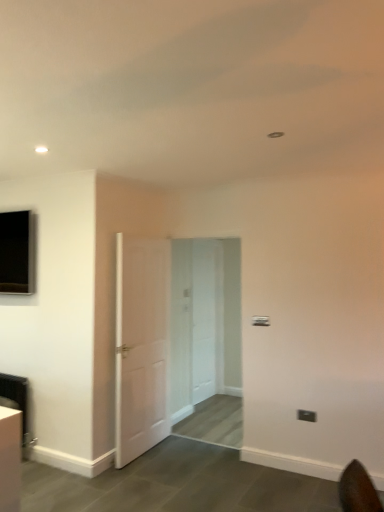
Find the location of a particular element. The width and height of the screenshot is (384, 512). black plastic electric outlet at lower right is located at coordinates (306, 415).

The image size is (384, 512). In order to click on white wooden door at center, marked as the 2th door in a left-to-right arrangement in this screenshot , I will do `click(206, 316)`.

Can you confirm if white wooden door at center, which appears as the first door when viewed from the back, is shorter than white matte door at center, arranged as the second door when viewed from the right?

Yes, white wooden door at center, which appears as the first door when viewed from the back, is shorter than white matte door at center, arranged as the second door when viewed from the right.

Is white wooden door at center, arranged as the 2th door when viewed from the front, not inside white matte door at center, arranged as the second door when viewed from the right?

white wooden door at center, arranged as the 2th door when viewed from the front, is positioned outside white matte door at center, arranged as the second door when viewed from the right.

Which object is positioned more to the right, white wooden door at center, which appears as the first door when viewed from the back, or white matte door at center, marked as the 1th door in a front-to-back arrangement?

From the viewer's perspective, white wooden door at center, which appears as the first door when viewed from the back, appears more on the right side.

Is black plastic electric outlet at lower right positioned far away from black glass window at upper left?

black plastic electric outlet at lower right is positioned a significant distance from black glass window at upper left.

Does black plastic electric outlet at lower right have a lesser width compared to black glass window at upper left?

Correct, the width of black plastic electric outlet at lower right is less than that of black glass window at upper left.

Is point (316, 419) less distant than point (30, 250)?

Yes, point (316, 419) is closer to viewer.

Is black plastic electric outlet at lower right further to camera compared to black glass window at upper left?

No, black plastic electric outlet at lower right is closer to the viewer.

Between white matte door at center, arranged as the second door when viewed from the right, and black glass window at upper left, which one has smaller width?

white matte door at center, arranged as the second door when viewed from the right.

Which object is further away from the camera, white matte door at center, arranged as the second door when viewed from the right, or black glass window at upper left?

black glass window at upper left is further away from the camera.

Considering the positions of objects white matte door at center, marked as the 1th door in a front-to-back arrangement, and black glass window at upper left in the image provided, who is more to the left, white matte door at center, marked as the 1th door in a front-to-back arrangement, or black glass window at upper left?

black glass window at upper left is more to the left.

From a real-world perspective, is white matte door at center, the 2th door viewed from the back, physically located above or below black glass window at upper left?

Clearly, from a real-world perspective, white matte door at center, the 2th door viewed from the back, is below black glass window at upper left.

Can you confirm if white wooden door at center, arranged as the 2th door when viewed from the front, is taller than black glass window at upper left?

Yes, white wooden door at center, arranged as the 2th door when viewed from the front, is taller than black glass window at upper left.

Where is `the 2nd door to the right of the black glass window at upper left, starting your count from the anchor`? the 2nd door to the right of the black glass window at upper left, starting your count from the anchor is located at coordinates (206, 316).

Does white wooden door at center, marked as the 2th door in a left-to-right arrangement, touch black glass window at upper left?

white wooden door at center, marked as the 2th door in a left-to-right arrangement, is not next to black glass window at upper left, and they're not touching.

Is white wooden door at center, marked as the 2th door in a left-to-right arrangement, facing towards black glass window at upper left?

No.

Is white wooden door at center, arranged as the 2th door when viewed from the front, to the right of black plastic electric outlet at lower right from the viewer's perspective?

Incorrect, white wooden door at center, arranged as the 2th door when viewed from the front, is not on the right side of black plastic electric outlet at lower right.

Could black plastic electric outlet at lower right be considered to be inside white wooden door at center, arranged as the 2th door when viewed from the front?

Actually, black plastic electric outlet at lower right is outside white wooden door at center, arranged as the 2th door when viewed from the front.

Based on the photo, considering the relative sizes of white wooden door at center, marked as the 2th door in a left-to-right arrangement, and black plastic electric outlet at lower right in the image provided, is white wooden door at center, marked as the 2th door in a left-to-right arrangement, shorter than black plastic electric outlet at lower right?

Incorrect, the height of white wooden door at center, marked as the 2th door in a left-to-right arrangement, does not fall short of that of black plastic electric outlet at lower right.

Can you see white wooden door at center, which appears as the first door when viewed from the back, touching black plastic electric outlet at lower right?

white wooden door at center, which appears as the first door when viewed from the back, and black plastic electric outlet at lower right are clearly separated.

From a real-world perspective, is black glass window at upper left physically located above or below white wooden door at center, arranged as the 2th door when viewed from the front?

From a real-world perspective, black glass window at upper left is physically above white wooden door at center, arranged as the 2th door when viewed from the front.

Looking at this image, from the image's perspective, which object appears higher, black glass window at upper left or white wooden door at center, arranged as the 2th door when viewed from the front?

black glass window at upper left appears higher in the image.

In the image, there is a white wooden door at center, marked as the 1th door in a right-to-left arrangement. Identify the location of window above it (from the image's perspective). (17, 252).

Could you tell me if black glass window at upper left is facing white wooden door at center, arranged as the 2th door when viewed from the front?

No.

Is black plastic electric outlet at lower right facing towards white wooden door at center, marked as the 1th door in a right-to-left arrangement?

No, black plastic electric outlet at lower right is not turned towards white wooden door at center, marked as the 1th door in a right-to-left arrangement.

What's the angular difference between black plastic electric outlet at lower right and white wooden door at center, arranged as the 2th door when viewed from the front,'s facing directions?

The angular difference between black plastic electric outlet at lower right and white wooden door at center, arranged as the 2th door when viewed from the front, is 88.8 degrees.

Which of these two, black plastic electric outlet at lower right or white wooden door at center, which appears as the first door when viewed from the back, is wider?

white wooden door at center, which appears as the first door when viewed from the back, is wider.

Which point is more forward, (304,414) or (215,368)?

Positioned in front is point (304,414).

Where is `door beneath the white wooden door at center, which appears as the first door when viewed from the back (from a real-world perspective)`? door beneath the white wooden door at center, which appears as the first door when viewed from the back (from a real-world perspective) is located at coordinates (141, 345).

Where is `electric outlet below the black glass window at upper left (from the image's perspective)`? The height and width of the screenshot is (512, 384). electric outlet below the black glass window at upper left (from the image's perspective) is located at coordinates pyautogui.click(x=306, y=415).

Which object lies nearer to the anchor point black plastic electric outlet at lower right, white matte door at center, which is the 1th door from left to right, or white wooden door at center, marked as the 1th door in a right-to-left arrangement?

white matte door at center, which is the 1th door from left to right, lies closer to black plastic electric outlet at lower right than the other object.

Looking at the image, which one is located closer to white wooden door at center, marked as the 1th door in a right-to-left arrangement, white matte door at center, arranged as the second door when viewed from the right, or black glass window at upper left?

white matte door at center, arranged as the second door when viewed from the right, lies closer to white wooden door at center, marked as the 1th door in a right-to-left arrangement, than the other object.

Considering their positions, is black glass window at upper left positioned further to white wooden door at center, which appears as the first door when viewed from the back, than white matte door at center, the 2th door viewed from the back?

The object further to white wooden door at center, which appears as the first door when viewed from the back, is black glass window at upper left.

Which object lies nearer to the anchor point white matte door at center, arranged as the second door when viewed from the right, black plastic electric outlet at lower right or white wooden door at center, marked as the 2th door in a left-to-right arrangement?

Based on the image, white wooden door at center, marked as the 2th door in a left-to-right arrangement, appears to be nearer to white matte door at center, arranged as the second door when viewed from the right.

In the scene shown: Considering their positions, is black plastic electric outlet at lower right positioned further to black glass window at upper left than white wooden door at center, marked as the 1th door in a right-to-left arrangement?

Among the two, black plastic electric outlet at lower right is located further to black glass window at upper left.

Based on their spatial positions, is black glass window at upper left or black plastic electric outlet at lower right closer to white wooden door at center, marked as the 1th door in a right-to-left arrangement?

black plastic electric outlet at lower right is positioned closer to the anchor white wooden door at center, marked as the 1th door in a right-to-left arrangement.

Considering their positions, is white matte door at center, which is the 1th door from left to right, positioned closer to black plastic electric outlet at lower right than black glass window at upper left?

white matte door at center, which is the 1th door from left to right, lies closer to black plastic electric outlet at lower right than the other object.

When comparing their distances from black plastic electric outlet at lower right, does black glass window at upper left or white wooden door at center, arranged as the 2th door when viewed from the front, seem further?

Among the two, black glass window at upper left is located further to black plastic electric outlet at lower right.

Where is `door between black glass window at upper left and white wooden door at center, marked as the 2th door in a left-to-right arrangement, in the horizontal direction`? Image resolution: width=384 pixels, height=512 pixels. door between black glass window at upper left and white wooden door at center, marked as the 2th door in a left-to-right arrangement, in the horizontal direction is located at coordinates (141, 345).

Where is `door between black plastic electric outlet at lower right and white wooden door at center, marked as the 2th door in a left-to-right arrangement, from front to back`? door between black plastic electric outlet at lower right and white wooden door at center, marked as the 2th door in a left-to-right arrangement, from front to back is located at coordinates (141, 345).